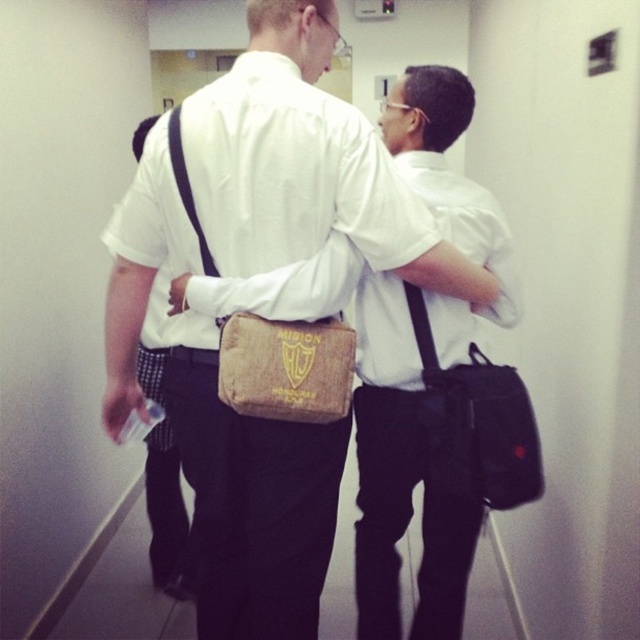
Question: Does black fabric messenger bag at right have a lesser width compared to matte brown bag at center?

Choices:
 (A) no
 (B) yes

Answer: (B)

Question: Estimate the real-world distances between objects in this image. Which object is closer to the brown canvas pouch at center?

Choices:
 (A) brown canvas bag at center
 (B) matte brown bag at center
 (C) black fabric messenger bag at right
 (D) white woven bag at center

Answer: (A)

Question: Is black fabric messenger bag at right positioned behind brown canvas pouch at center?

Choices:
 (A) yes
 (B) no

Answer: (A)

Question: Does black fabric messenger bag at right appear over matte brown bag at center?

Choices:
 (A) yes
 (B) no

Answer: (A)

Question: Which point appears farthest from the camera in this image?

Choices:
 (A) (499, 420)
 (B) (227, 248)
 (C) (419, 243)

Answer: (A)

Question: Which object appears farthest from the camera in this image?

Choices:
 (A) white woven bag at center
 (B) brown canvas pouch at center
 (C) black fabric messenger bag at right

Answer: (C)